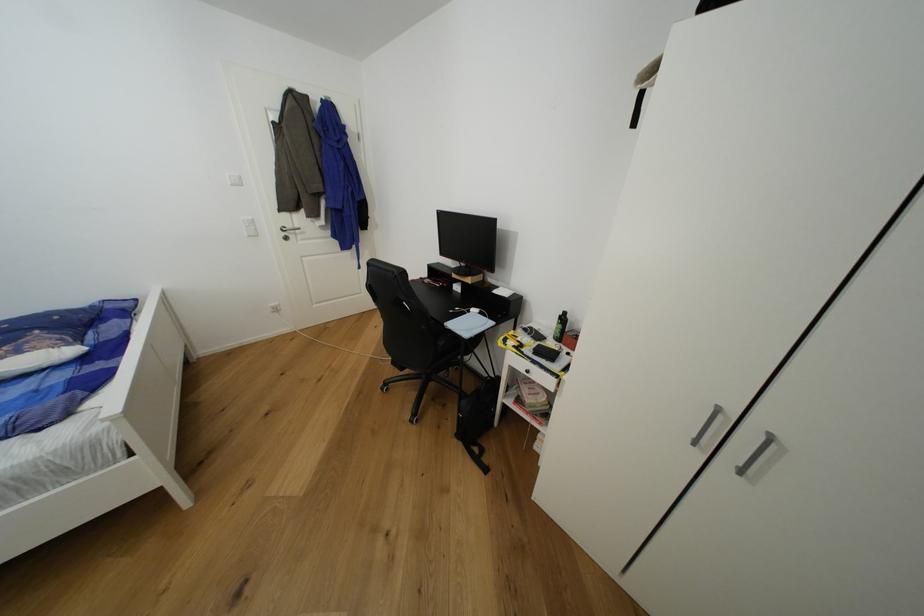
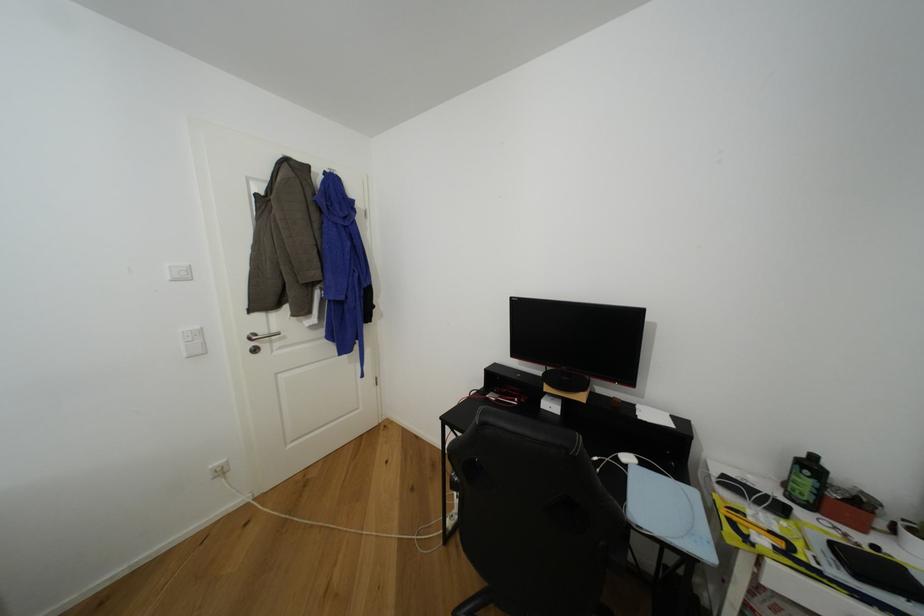
In a continuous first-person perspective shot, in which direction is the camera moving?

The cameraman moved toward left, forward.